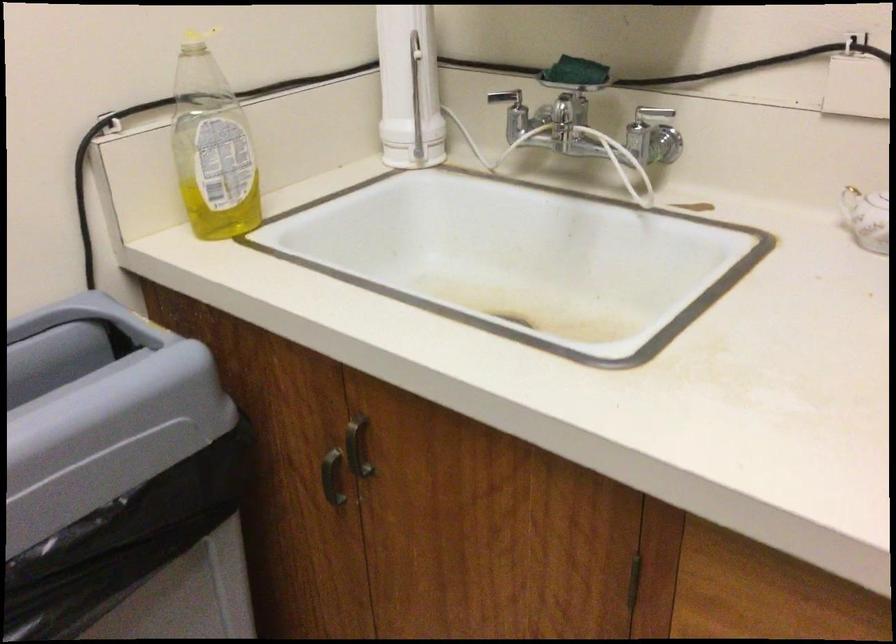
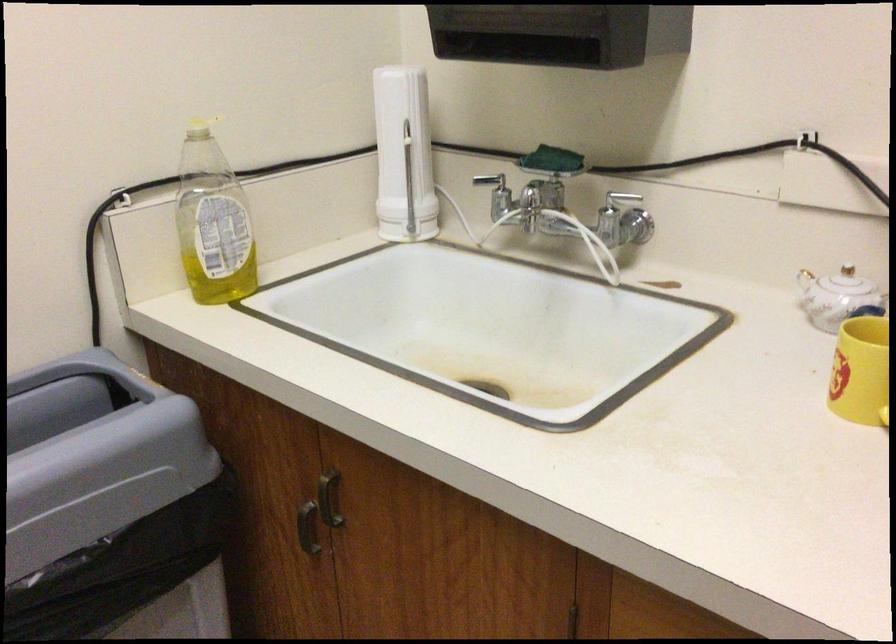
Find the pixel in the second image that matches [643,145] in the first image.

(615, 225)